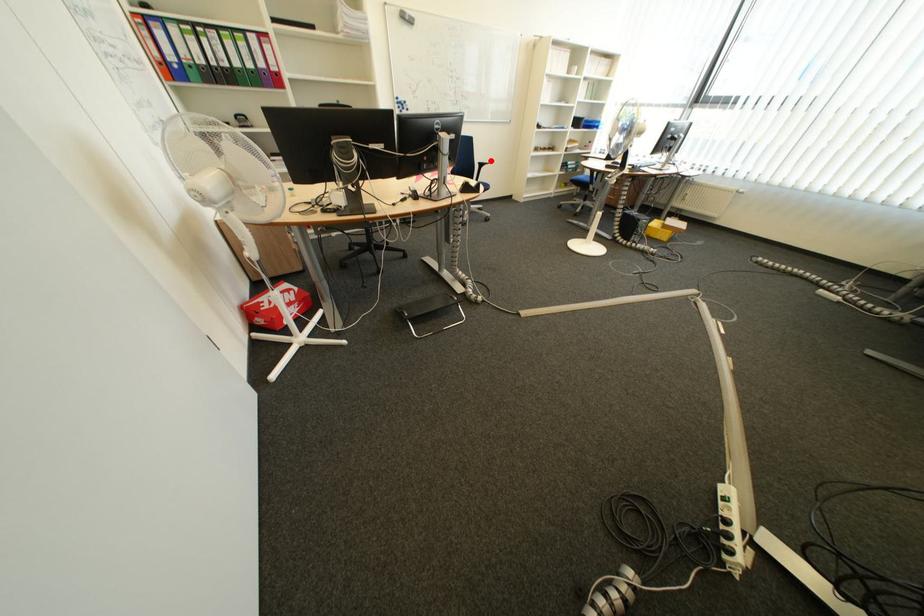
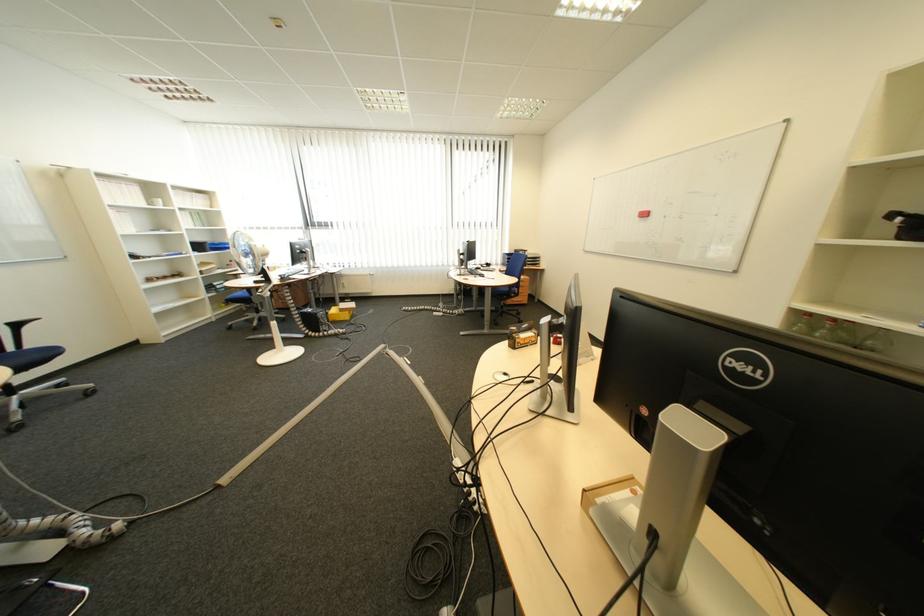
Question: I am providing you with two images of the same scene from different viewpoints. Given a red point in image1, look at the same physical point in image2. Is it:

Choices:
 (A) Closer to the viewpoint
 (B) Farther from the viewpoint

Answer: (B)